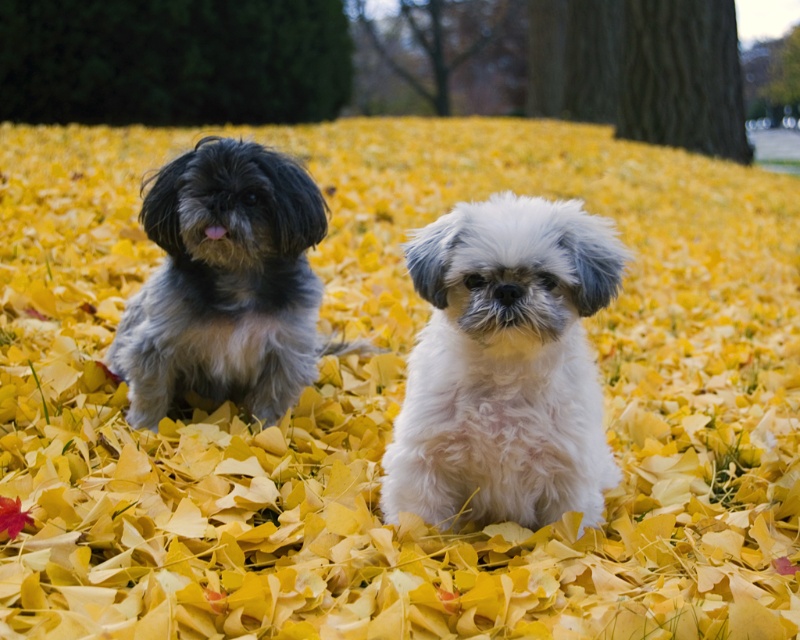
What are the coordinates of `white fluffy dog at center` in the screenshot? It's located at (504, 365).

Can you confirm if white fluffy dog at center is smaller than fluffy gray dog at left?

Yes.

The width and height of the screenshot is (800, 640). Find the location of `white fluffy dog at center`. white fluffy dog at center is located at coordinates (504, 365).